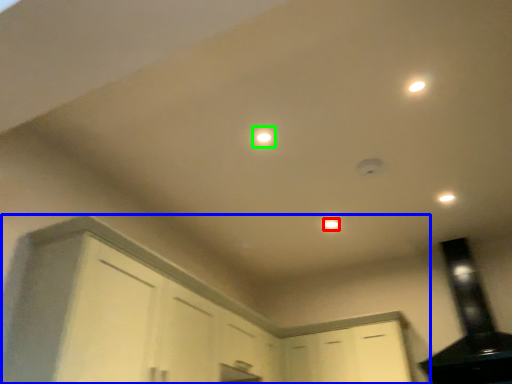
Question: Which object is the closest to the dot (highlighted by a red box)? Choose among these: cabinetry (highlighted by a blue box) or light (highlighted by a green box).

Choices:
 (A) cabinetry
 (B) light

Answer: (B)